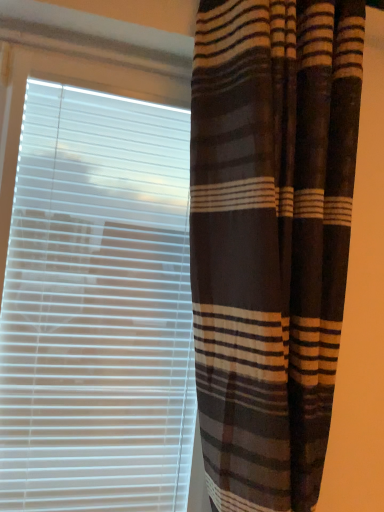
You are a GUI agent. You are given a task and a screenshot of the screen. Output one action in this format:
    pyautogui.click(x=<x>, y=<y>)
    Task: Click on the brown striped curtain at right
    
    Given the screenshot: What is the action you would take?
    pyautogui.click(x=271, y=238)

The image size is (384, 512). Describe the element at coordinates (271, 238) in the screenshot. I see `brown striped curtain at right` at that location.

In order to click on white plastic blinds at left in this screenshot , I will do `click(94, 288)`.

What do you see at coordinates (94, 288) in the screenshot? Image resolution: width=384 pixels, height=512 pixels. I see `white plastic blinds at left` at bounding box center [94, 288].

Locate an element on the screen. brown striped curtain at right is located at coordinates (271, 238).

Consider the image. Considering the relative positions of white plastic blinds at left and brown striped curtain at right in the image provided, is white plastic blinds at left to the left of brown striped curtain at right from the viewer's perspective?

Indeed, white plastic blinds at left is positioned on the left side of brown striped curtain at right.

Considering the positions of objects white plastic blinds at left and brown striped curtain at right in the image provided, who is in front, white plastic blinds at left or brown striped curtain at right?

brown striped curtain at right.

Considering the positions of point (142, 504) and point (237, 326), is point (142, 504) closer or farther from the camera than point (237, 326)?

Point (142, 504) appears to be farther away from the viewer than point (237, 326).

From the image's perspective, is white plastic blinds at left on brown striped curtain at right?

Actually, white plastic blinds at left appears below brown striped curtain at right in the image.

From a real-world perspective, is white plastic blinds at left below brown striped curtain at right?

Yes, from a real-world perspective, white plastic blinds at left is beneath brown striped curtain at right.

Which of these two, white plastic blinds at left or brown striped curtain at right, is thinner?

white plastic blinds at left.

Is white plastic blinds at left shorter than brown striped curtain at right?

Indeed, white plastic blinds at left has a lesser height compared to brown striped curtain at right.

Who is bigger, white plastic blinds at left or brown striped curtain at right?

brown striped curtain at right.

Would you say white plastic blinds at left is outside brown striped curtain at right?

Absolutely, white plastic blinds at left is external to brown striped curtain at right.

Is white plastic blinds at left far away from brown striped curtain at right?

No, white plastic blinds at left is not far from brown striped curtain at right.

Is white plastic blinds at left facing away from brown striped curtain at right?

white plastic blinds at left is not turned away from brown striped curtain at right.

How many degrees apart are the facing directions of white plastic blinds at left and brown striped curtain at right?

3.84 degrees.

How much distance is there between white plastic blinds at left and brown striped curtain at right?

white plastic blinds at left and brown striped curtain at right are 26.35 centimeters apart.

Locate an element on the screen. This screenshot has height=512, width=384. window blind below the brown striped curtain at right (from a real-world perspective) is located at coordinates (94, 288).

Which is more to the left, brown striped curtain at right or white plastic blinds at left?

white plastic blinds at left is more to the left.

Relative to white plastic blinds at left, is brown striped curtain at right in front or behind?

brown striped curtain at right is in front of white plastic blinds at left.

Is point (269, 23) in front of point (1, 262)?

Yes, point (269, 23) is in front of point (1, 262).

From the image's perspective, is brown striped curtain at right over white plastic blinds at left?

Correct, brown striped curtain at right appears higher than white plastic blinds at left in the image.

From a real-world perspective, does brown striped curtain at right sit lower than white plastic blinds at left?

Incorrect, from a real-world perspective, brown striped curtain at right is higher than white plastic blinds at left.

Can you confirm if brown striped curtain at right is thinner than white plastic blinds at left?

No.

Does brown striped curtain at right have a greater height compared to white plastic blinds at left?

Yes.

Who is bigger, brown striped curtain at right or white plastic blinds at left?

With larger size is brown striped curtain at right.

Can we say brown striped curtain at right lies outside white plastic blinds at left?

Yes, brown striped curtain at right is outside of white plastic blinds at left.

Are brown striped curtain at right and white plastic blinds at left far apart?

Actually, brown striped curtain at right and white plastic blinds at left are a little close together.

Is brown striped curtain at right oriented towards white plastic blinds at left?

No, brown striped curtain at right is not turned towards white plastic blinds at left.

How many degrees apart are the facing directions of brown striped curtain at right and white plastic blinds at left?

There is a 3.84-degree angle between the facing directions of brown striped curtain at right and white plastic blinds at left.

The height and width of the screenshot is (512, 384). What are the coordinates of `curtain on the right of white plastic blinds at left` in the screenshot? It's located at (271, 238).

This screenshot has height=512, width=384. I want to click on curtain above the white plastic blinds at left (from a real-world perspective), so click(271, 238).

Locate an element on the screen. Image resolution: width=384 pixels, height=512 pixels. window blind behind the brown striped curtain at right is located at coordinates (94, 288).